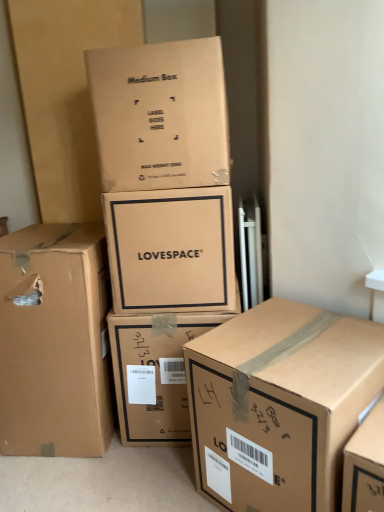
In order to face brown cardboard box at left, which is counted as the first box, starting from the left, should I rotate leftwards or rightwards?

Rotate your view left by about 16.876°.

You are a GUI agent. You are given a task and a screenshot of the screen. Output one action in this format:
    pyautogui.click(x=<x>, y=<y>)
    Task: Click on the matte cardboard box at center, marked as the third box in a right-to-left arrangement
    The width and height of the screenshot is (384, 512).
    Given the screenshot: What is the action you would take?
    pyautogui.click(x=171, y=250)

You are a GUI agent. You are given a task and a screenshot of the screen. Output one action in this format:
    pyautogui.click(x=<x>, y=<y>)
    Task: Click on the brown cardboard box at upper center, marked as the fourth box in a right-to-left arrangement
    This screenshot has height=512, width=384.
    Given the screenshot: What is the action you would take?
    pyautogui.click(x=160, y=115)

Describe the element at coordinates (279, 404) in the screenshot. I see `brown cardboard box at lower right, acting as the first box starting from the right` at that location.

In order to click on brown cardboard box at left, which is counted as the first box, starting from the left in this screenshot , I will do `click(55, 342)`.

From the image's perspective, which box is the 3rd one below the brown cardboard box at upper center, marked as the fourth box in a right-to-left arrangement? Please provide its 2D coordinates.

[(154, 374)]

How many degrees apart are the facing directions of brown cardboard box at upper center, arranged as the 2th box when viewed from the left, and brown cardboard box at center, marked as the fourth box in a left-to-right arrangement?

They differ by 0.178 degrees in their facing directions.

Which is behind, point (224, 142) or point (184, 396)?

The point (184, 396) is farther from the camera.

Which is correct: brown cardboard box at upper center, arranged as the 2th box when viewed from the left, is inside brown cardboard box at center, arranged as the second box when viewed from the right, or outside of it?

brown cardboard box at upper center, arranged as the 2th box when viewed from the left, is spatially situated outside brown cardboard box at center, arranged as the second box when viewed from the right.

Considering the positions of objects brown cardboard box at center, marked as the fourth box in a left-to-right arrangement, and brown cardboard box at left, which is counted as the first box, starting from the left, in the image provided, who is more to the right, brown cardboard box at center, marked as the fourth box in a left-to-right arrangement, or brown cardboard box at left, which is counted as the first box, starting from the left,?

A: brown cardboard box at center, marked as the fourth box in a left-to-right arrangement, is more to the right.

Consider the image. Is brown cardboard box at center, marked as the fourth box in a left-to-right arrangement, smaller than brown cardboard box at left, which is counted as the first box, starting from the left?

Correct, brown cardboard box at center, marked as the fourth box in a left-to-right arrangement, occupies less space than brown cardboard box at left, which is counted as the first box, starting from the left.

How many degrees apart are the facing directions of brown cardboard box at center, arranged as the second box when viewed from the right, and brown cardboard box at left, arranged as the fifth box when viewed from the right?

The angular difference between brown cardboard box at center, arranged as the second box when viewed from the right, and brown cardboard box at left, arranged as the fifth box when viewed from the right, is 0.393 degrees.

Considering the sizes of objects brown cardboard box at center, arranged as the second box when viewed from the right, and brown cardboard box at left, arranged as the fifth box when viewed from the right, in the image provided, who is wider, brown cardboard box at center, arranged as the second box when viewed from the right, or brown cardboard box at left, arranged as the fifth box when viewed from the right,?

Wider between the two is brown cardboard box at left, arranged as the fifth box when viewed from the right.

Could you measure the distance between brown cardboard box at left, which is counted as the first box, starting from the left, and brown cardboard box at upper center, arranged as the 2th box when viewed from the left?

The distance of brown cardboard box at left, which is counted as the first box, starting from the left, from brown cardboard box at upper center, arranged as the 2th box when viewed from the left, is 21.94 inches.

Considering the sizes of objects brown cardboard box at left, arranged as the fifth box when viewed from the right, and brown cardboard box at upper center, marked as the fourth box in a right-to-left arrangement, in the image provided, who is shorter, brown cardboard box at left, arranged as the fifth box when viewed from the right, or brown cardboard box at upper center, marked as the fourth box in a right-to-left arrangement,?

With less height is brown cardboard box at upper center, marked as the fourth box in a right-to-left arrangement.

In terms of size, does brown cardboard box at left, arranged as the fifth box when viewed from the right, appear bigger or smaller than brown cardboard box at upper center, arranged as the 2th box when viewed from the left?

brown cardboard box at left, arranged as the fifth box when viewed from the right, is bigger than brown cardboard box at upper center, arranged as the 2th box when viewed from the left.

In the scene shown: Which is behind, brown cardboard box at left, arranged as the fifth box when viewed from the right, or brown cardboard box at upper center, marked as the fourth box in a right-to-left arrangement?

brown cardboard box at left, arranged as the fifth box when viewed from the right, is further from the camera.

Between brown cardboard box at lower right, marked as the 5th box in a left-to-right arrangement, and brown cardboard box at upper center, marked as the fourth box in a right-to-left arrangement, which one has smaller width?

With smaller width is brown cardboard box at upper center, marked as the fourth box in a right-to-left arrangement.

Is brown cardboard box at lower right, acting as the first box starting from the right, in front of or behind brown cardboard box at upper center, marked as the fourth box in a right-to-left arrangement, in the image?

Visually, brown cardboard box at lower right, acting as the first box starting from the right, is located in front of brown cardboard box at upper center, marked as the fourth box in a right-to-left arrangement.

Looking at this image, is brown cardboard box at lower right, acting as the first box starting from the right, situated inside brown cardboard box at upper center, marked as the fourth box in a right-to-left arrangement, or outside?

brown cardboard box at lower right, acting as the first box starting from the right, exists outside the volume of brown cardboard box at upper center, marked as the fourth box in a right-to-left arrangement.

From the image's perspective, is brown cardboard box at lower right, marked as the 5th box in a left-to-right arrangement, under brown cardboard box at upper center, arranged as the 2th box when viewed from the left?

Correct, brown cardboard box at lower right, marked as the 5th box in a left-to-right arrangement, appears lower than brown cardboard box at upper center, arranged as the 2th box when viewed from the left, in the image.

Is brown cardboard box at upper center, arranged as the 2th box when viewed from the left, far away from brown cardboard box at left, arranged as the fifth box when viewed from the right?

No, brown cardboard box at upper center, arranged as the 2th box when viewed from the left, is not far away from brown cardboard box at left, arranged as the fifth box when viewed from the right.

Can you confirm if brown cardboard box at upper center, arranged as the 2th box when viewed from the left, is thinner than brown cardboard box at left, arranged as the fifth box when viewed from the right?

Indeed, brown cardboard box at upper center, arranged as the 2th box when viewed from the left, has a lesser width compared to brown cardboard box at left, arranged as the fifth box when viewed from the right.

Considering the sizes of brown cardboard box at upper center, marked as the fourth box in a right-to-left arrangement, and brown cardboard box at left, arranged as the fifth box when viewed from the right, in the image, is brown cardboard box at upper center, marked as the fourth box in a right-to-left arrangement, taller or shorter than brown cardboard box at left, arranged as the fifth box when viewed from the right,?

Clearly, brown cardboard box at upper center, marked as the fourth box in a right-to-left arrangement, is shorter compared to brown cardboard box at left, arranged as the fifth box when viewed from the right.

How different are the orientations of brown cardboard box at upper center, arranged as the 2th box when viewed from the left, and brown cardboard box at left, which is counted as the first box, starting from the left, in degrees?

They differ by 0.571 degrees in their facing directions.

Is brown cardboard box at left, which is counted as the first box, starting from the left, inside the boundaries of brown cardboard box at lower right, acting as the first box starting from the right, or outside?

brown cardboard box at left, which is counted as the first box, starting from the left, is outside brown cardboard box at lower right, acting as the first box starting from the right.

Which of these two, brown cardboard box at left, which is counted as the first box, starting from the left, or brown cardboard box at lower right, marked as the 5th box in a left-to-right arrangement, is bigger?

With larger size is brown cardboard box at left, which is counted as the first box, starting from the left.

Considering the points (7, 403) and (211, 408), which point is behind, point (7, 403) or point (211, 408)?

The point (7, 403) is farther.

How different are the orientations of brown cardboard box at left, arranged as the fifth box when viewed from the right, and brown cardboard box at lower right, acting as the first box starting from the right, in degrees?

brown cardboard box at left, arranged as the fifth box when viewed from the right, and brown cardboard box at lower right, acting as the first box starting from the right, are facing 40.5 degrees away from each other.

Is brown cardboard box at center, marked as the fourth box in a left-to-right arrangement, located within brown cardboard box at left, which is counted as the first box, starting from the left?

No, brown cardboard box at left, which is counted as the first box, starting from the left, does not contain brown cardboard box at center, marked as the fourth box in a left-to-right arrangement.

Is brown cardboard box at left, which is counted as the first box, starting from the left, positioned with its back to brown cardboard box at center, marked as the fourth box in a left-to-right arrangement?

brown cardboard box at left, which is counted as the first box, starting from the left, is not turned away from brown cardboard box at center, marked as the fourth box in a left-to-right arrangement.

From a real-world perspective, is brown cardboard box at left, which is counted as the first box, starting from the left, below brown cardboard box at center, marked as the fourth box in a left-to-right arrangement?

Actually, brown cardboard box at left, which is counted as the first box, starting from the left, is physically above brown cardboard box at center, marked as the fourth box in a left-to-right arrangement, in the real world.

Considering the points (49, 411) and (182, 362), which point is behind, point (49, 411) or point (182, 362)?

The point (49, 411) is behind.

You are a GUI agent. You are given a task and a screenshot of the screen. Output one action in this format:
    pyautogui.click(x=<x>, y=<y>)
    Task: Click on the 3rd box in front when counting from the brown cardboard box at center, marked as the fourth box in a left-to-right arrangement
    Image resolution: width=384 pixels, height=512 pixels.
    Given the screenshot: What is the action you would take?
    pyautogui.click(x=160, y=115)

This screenshot has width=384, height=512. In order to click on box that is the 3rd object to the right of the brown cardboard box at left, arranged as the fifth box when viewed from the right, starting at the anchor in this screenshot , I will do `click(154, 374)`.

Based on their spatial positions, is brown cardboard box at lower right, acting as the first box starting from the right, or brown cardboard box at left, which is counted as the first box, starting from the left, further from brown cardboard box at upper center, arranged as the 2th box when viewed from the left?

Answer: Based on the image, brown cardboard box at lower right, acting as the first box starting from the right, appears to be further to brown cardboard box at upper center, arranged as the 2th box when viewed from the left.

Considering their positions, is brown cardboard box at left, arranged as the fifth box when viewed from the right, positioned further to matte cardboard box at center, the third box positioned from the left, than brown cardboard box at upper center, arranged as the 2th box when viewed from the left?

brown cardboard box at left, arranged as the fifth box when viewed from the right.

Estimate the real-world distances between objects in this image. Which object is further from brown cardboard box at center, marked as the fourth box in a left-to-right arrangement, brown cardboard box at left, which is counted as the first box, starting from the left, or brown cardboard box at upper center, marked as the fourth box in a right-to-left arrangement?

Based on the image, brown cardboard box at upper center, marked as the fourth box in a right-to-left arrangement, appears to be further to brown cardboard box at center, marked as the fourth box in a left-to-right arrangement.

Considering their positions, is brown cardboard box at center, marked as the fourth box in a left-to-right arrangement, positioned closer to brown cardboard box at lower right, marked as the 5th box in a left-to-right arrangement, than brown cardboard box at upper center, arranged as the 2th box when viewed from the left?

The object closer to brown cardboard box at lower right, marked as the 5th box in a left-to-right arrangement, is brown cardboard box at center, marked as the fourth box in a left-to-right arrangement.

In the scene shown: Looking at the image, which one is located closer to brown cardboard box at lower right, marked as the 5th box in a left-to-right arrangement, brown cardboard box at left, arranged as the fifth box when viewed from the right, or brown cardboard box at upper center, arranged as the 2th box when viewed from the left?

brown cardboard box at left, arranged as the fifth box when viewed from the right, is closer to brown cardboard box at lower right, marked as the 5th box in a left-to-right arrangement.

Estimate the real-world distances between objects in this image. Which object is closer to brown cardboard box at left, which is counted as the first box, starting from the left, brown cardboard box at lower right, acting as the first box starting from the right, or brown cardboard box at center, arranged as the second box when viewed from the right?

brown cardboard box at center, arranged as the second box when viewed from the right, is closer to brown cardboard box at left, which is counted as the first box, starting from the left.

Considering their positions, is brown cardboard box at upper center, marked as the fourth box in a right-to-left arrangement, positioned closer to brown cardboard box at lower right, acting as the first box starting from the right, than brown cardboard box at center, arranged as the second box when viewed from the right?

brown cardboard box at center, arranged as the second box when viewed from the right, is positioned closer to the anchor brown cardboard box at lower right, acting as the first box starting from the right.

When comparing their distances from brown cardboard box at lower right, marked as the 5th box in a left-to-right arrangement, does brown cardboard box at center, arranged as the second box when viewed from the right, or matte cardboard box at center, marked as the third box in a right-to-left arrangement, seem closer?

brown cardboard box at center, arranged as the second box when viewed from the right, lies closer to brown cardboard box at lower right, marked as the 5th box in a left-to-right arrangement, than the other object.

The width and height of the screenshot is (384, 512). Find the location of `box between brown cardboard box at upper center, arranged as the 2th box when viewed from the left, and brown cardboard box at left, arranged as the fifth box when viewed from the right, in the vertical direction`. box between brown cardboard box at upper center, arranged as the 2th box when viewed from the left, and brown cardboard box at left, arranged as the fifth box when viewed from the right, in the vertical direction is located at coordinates (171, 250).